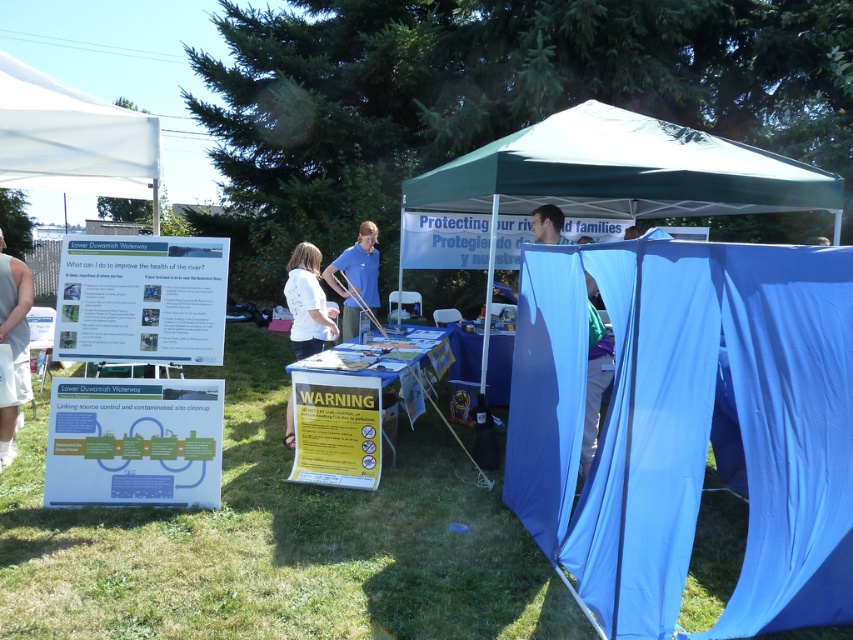
Question: Which object appears closest to the camera in this image?

Choices:
 (A) green grass at lower left
 (B) white matte shirt at center
 (C) white fabric canopy at upper left
 (D) white fabric at left

Answer: (A)

Question: Does blue fabric tent at center have a smaller size compared to white fabric at left?

Choices:
 (A) yes
 (B) no

Answer: (B)

Question: Which of the following is the farthest from the observer?

Choices:
 (A) green grass at lower left
 (B) white matte shirt at center
 (C) blue fabric tent at center

Answer: (B)

Question: Does white fabric canopy at upper left appear on the right side of white fabric at left?

Choices:
 (A) no
 (B) yes

Answer: (B)

Question: Where is blue fabric tent at center located in relation to green grass at lower left in the image?

Choices:
 (A) right
 (B) left

Answer: (A)

Question: Which object is positioned farthest from the white fabric at left?

Choices:
 (A) blue smooth shirt at center
 (B) blue fabric tent at center

Answer: (B)